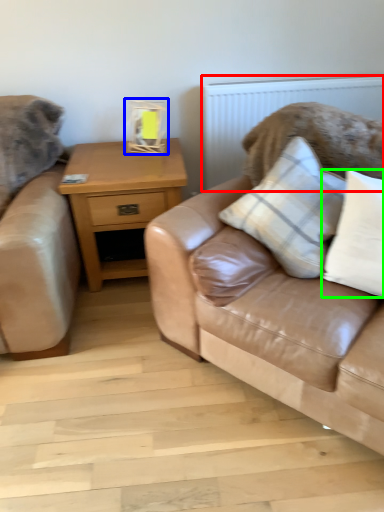
Question: Which object is the farthest from radiator (highlighted by a red box)? Choose among these: table lamp (highlighted by a blue box) or pillow (highlighted by a green box).

Choices:
 (A) table lamp
 (B) pillow

Answer: (B)